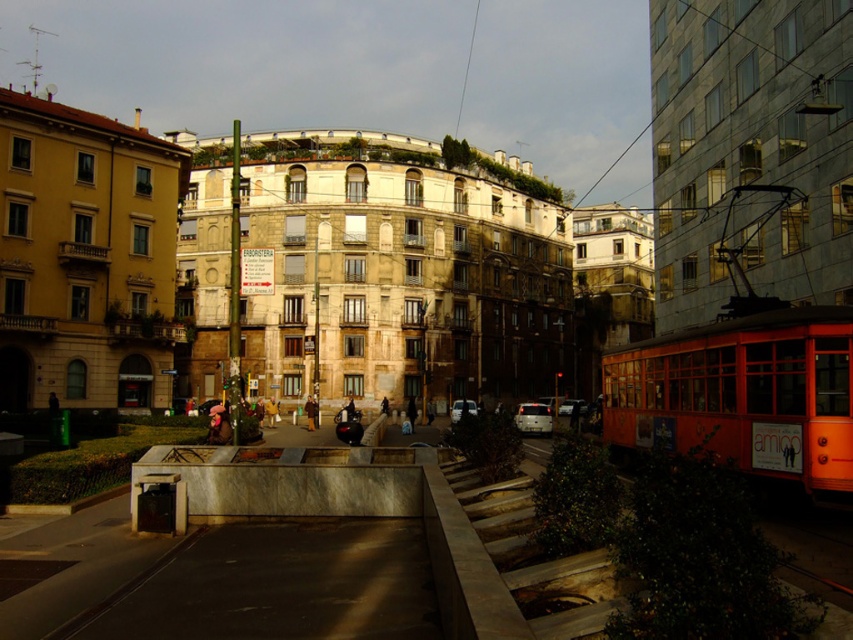
Can you confirm if matte black car at center is bigger than silver metallic car at center?

Correct, matte black car at center is larger in size than silver metallic car at center.

You are a GUI agent. You are given a task and a screenshot of the screen. Output one action in this format:
    pyautogui.click(x=<x>, y=<y>)
    Task: Click on the matte black car at center
    The image size is (853, 640).
    Given the screenshot: What is the action you would take?
    pyautogui.click(x=532, y=419)

Image resolution: width=853 pixels, height=640 pixels. What do you see at coordinates (532, 419) in the screenshot?
I see `matte black car at center` at bounding box center [532, 419].

Where is `matte black car at center`? The image size is (853, 640). matte black car at center is located at coordinates [x=532, y=419].

Find the location of `white glossy car at center`. white glossy car at center is located at coordinates (462, 408).

Can you confirm if white glossy car at center is positioned below silver metallic car at center?

Incorrect, white glossy car at center is not positioned below silver metallic car at center.

Between point (469, 401) and point (566, 410), which one is positioned behind?

The point (566, 410) is more distant.

The width and height of the screenshot is (853, 640). Identify the location of white glossy car at center. (462, 408).

Is point (521, 406) farther from viewer compared to point (456, 403)?

No, (521, 406) is in front of (456, 403).

Who is higher up, matte black car at center or white glossy car at center?

white glossy car at center is higher up.

What do you see at coordinates (532, 419) in the screenshot? Image resolution: width=853 pixels, height=640 pixels. I see `matte black car at center` at bounding box center [532, 419].

Image resolution: width=853 pixels, height=640 pixels. I want to click on matte black car at center, so click(x=532, y=419).